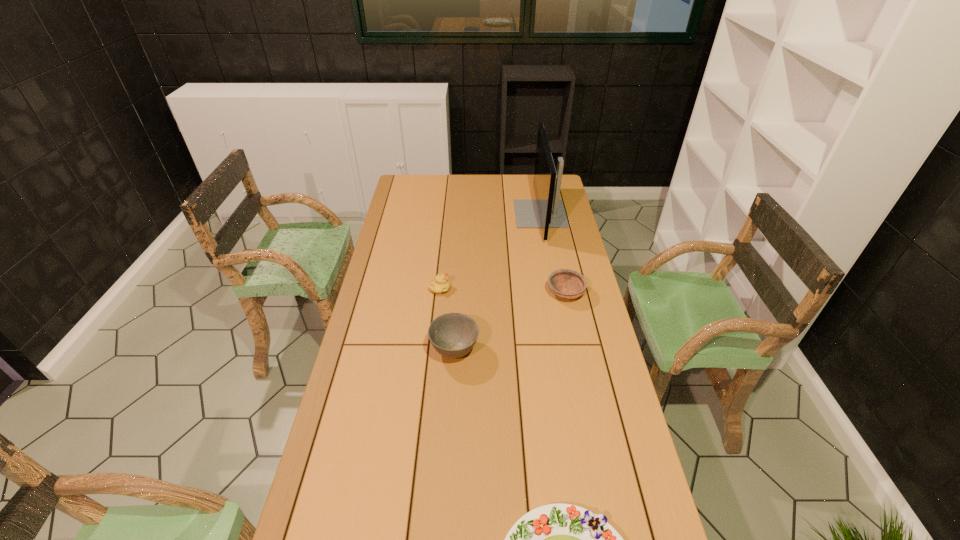
Locate an element on the screen. vacant space located 0.100m on the left of the fourth shortest object is located at coordinates (400, 350).

I want to click on vacant space located 0.050m on the beak of the duckling, so click(x=463, y=288).

Identify the location of vacant point located 0.300m on the left of the fourth tallest object. The width and height of the screenshot is (960, 540). point(468,293).

Locate an element on the screen. This screenshot has height=540, width=960. object that is positioned at the far edge is located at coordinates (547, 211).

The height and width of the screenshot is (540, 960). What are the coordinates of `computer monitor positioned at the right edge` in the screenshot? It's located at (547, 211).

Where is `bowl present at the right edge`? This screenshot has height=540, width=960. bowl present at the right edge is located at coordinates (568, 284).

Locate an element on the screen. The width and height of the screenshot is (960, 540). object located in the far right corner section of the desktop is located at coordinates (547, 211).

Identify the location of vacant space at the far edge of the desktop. (437, 188).

Find the location of a particular element. free space at the left edge is located at coordinates (317, 511).

In the image, there is a desktop. Identify the location of vacant area at the right edge. (610, 366).